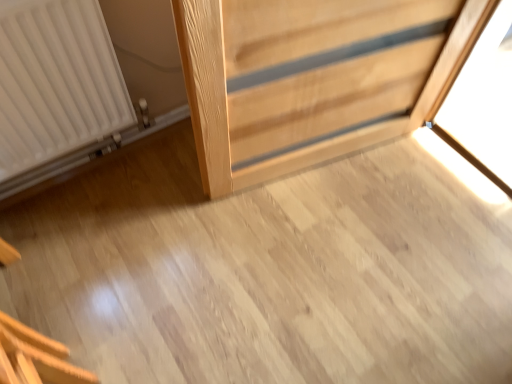
This screenshot has height=384, width=512. What are the coordinates of `free spot in front of white textured radiator at lower left` in the screenshot? It's located at (112, 249).